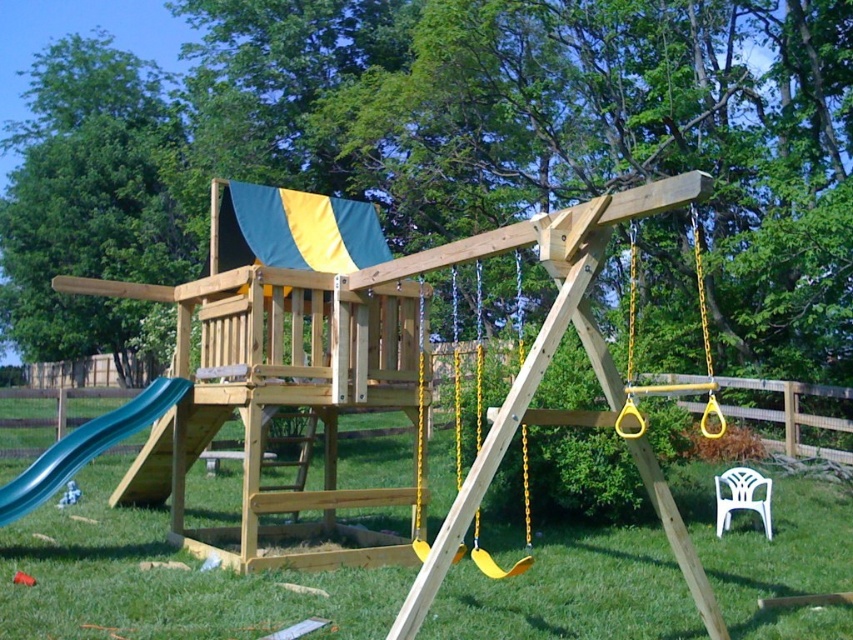
Question: Which of the following is the closest to the observer?

Choices:
 (A) (525, 435)
 (B) (567, 625)

Answer: (B)

Question: Which object appears closest to the camera in this image?

Choices:
 (A) wooden swing set at center
 (B) white plastic chair at lower right

Answer: (A)

Question: Can you confirm if green plastic slide at lower left is positioned to the right of yellow plastic swing at center?

Choices:
 (A) yes
 (B) no

Answer: (B)

Question: Which of the following is the closest to the observer?

Choices:
 (A) white plastic chair at lower right
 (B) yellow plastic swing at center

Answer: (B)

Question: Can you confirm if green plastic slide at lower left is smaller than yellow plastic swing at center?

Choices:
 (A) yes
 (B) no

Answer: (A)

Question: Is green plastic slide at lower left to the left of yellow plastic swing at center from the viewer's perspective?

Choices:
 (A) yes
 (B) no

Answer: (A)